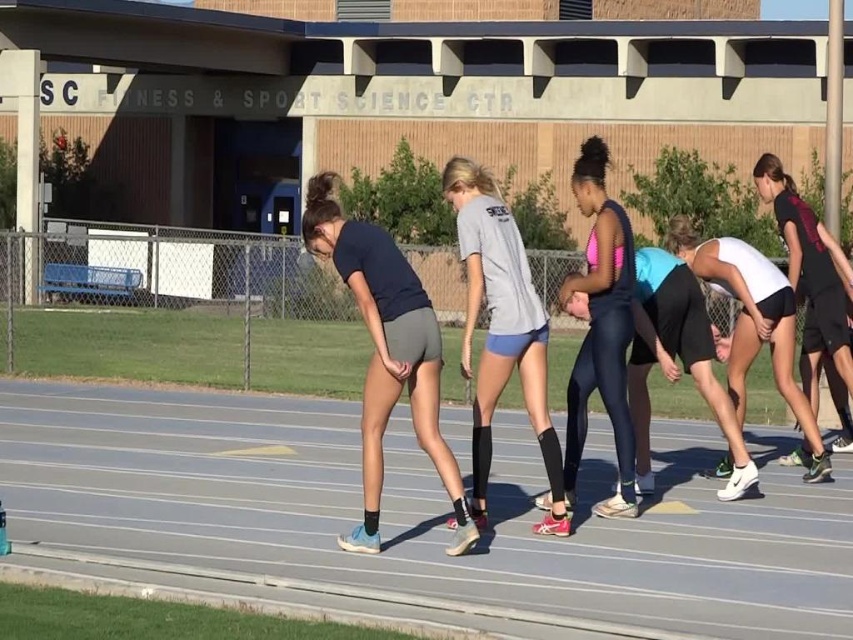
You are a photographer positioned at the starting line of the track. You want to capture a photo that includes both the white matte tank top at center and the black athletic shorts at right. Based on their positions, which direction should you move to ensure both are in frame?

The white matte tank top at center is to the left of the black athletic shorts at right. To include both in the frame, you should move to the left so that the black athletic shorts at right remains in view while ensuring the white matte tank top at center is also captured.

You are a photographer trying to capture a photo of the matte gray shorts at center and the matte pink tank top at center. You want to ensure both are visible in the frame. Based on their positions, which one should you focus on first to make sure they are both in the shot?

Since the matte gray shorts at center is positioned on the left side of matte pink tank top at center, you should focus on the matte pink tank top at center first to ensure both are within the frame as the leftmost object needs to be included first.